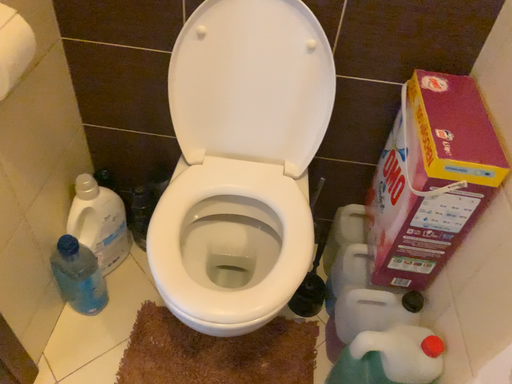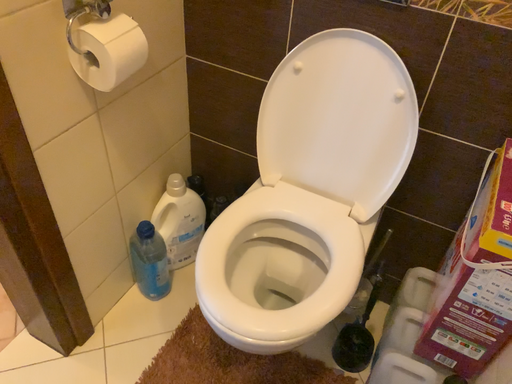
Question: Which way did the camera rotate in the video?

Choices:
 (A) rotated left
 (B) rotated right

Answer: (A)